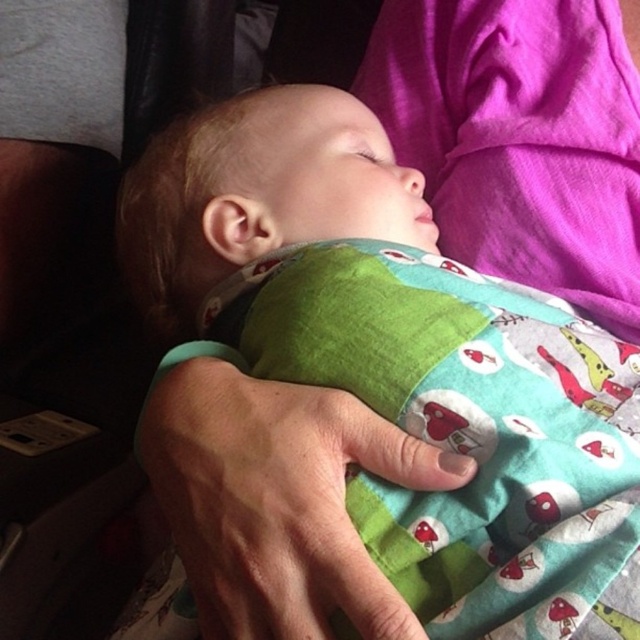
Does soft cotton baby at center appear on the left side of green fabric at center?

Incorrect, soft cotton baby at center is not on the left side of green fabric at center.

Between point (568, 344) and point (256, 529), which one is positioned in front?

Point (256, 529) is in front.

Identify the location of soft cotton baby at center. The image size is (640, 640). (397, 353).